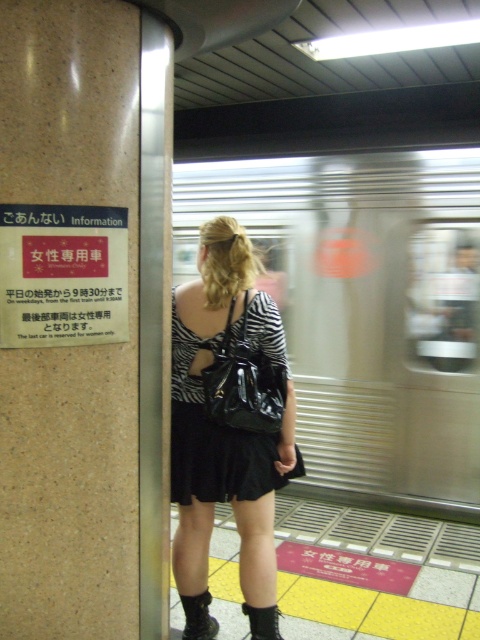
Between granite-like pillar at left and black leather boot at lower center, which one is positioned higher?

granite-like pillar at left is above.

Can you confirm if granite-like pillar at left is positioned below black leather boot at lower center?

No.

Locate an element on the screen. This screenshot has height=640, width=480. granite-like pillar at left is located at coordinates (70, 348).

What are the coordinates of `granite-like pillar at left` in the screenshot? It's located at (70, 348).

Is point (282, 344) positioned after point (241, 358)?

Yes, point (282, 344) is behind point (241, 358).

Is point (172, 464) closer to viewer compared to point (277, 406)?

No.

Identify the location of black satin dress at center. The image size is (480, 640). (214, 436).

Does point (424, 273) come in front of point (276, 385)?

No, (424, 273) is further to viewer.

What do you see at coordinates (365, 312) in the screenshot?
I see `silver metallic train at center` at bounding box center [365, 312].

The image size is (480, 640). What do you see at coordinates (365, 312) in the screenshot?
I see `silver metallic train at center` at bounding box center [365, 312].

Locate an element on the screen. This screenshot has width=480, height=640. silver metallic train at center is located at coordinates (365, 312).